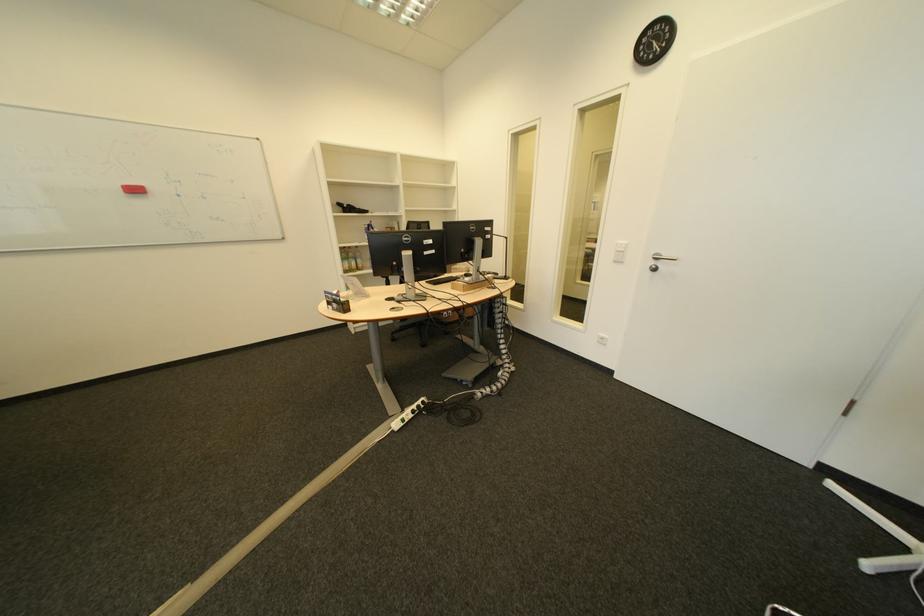
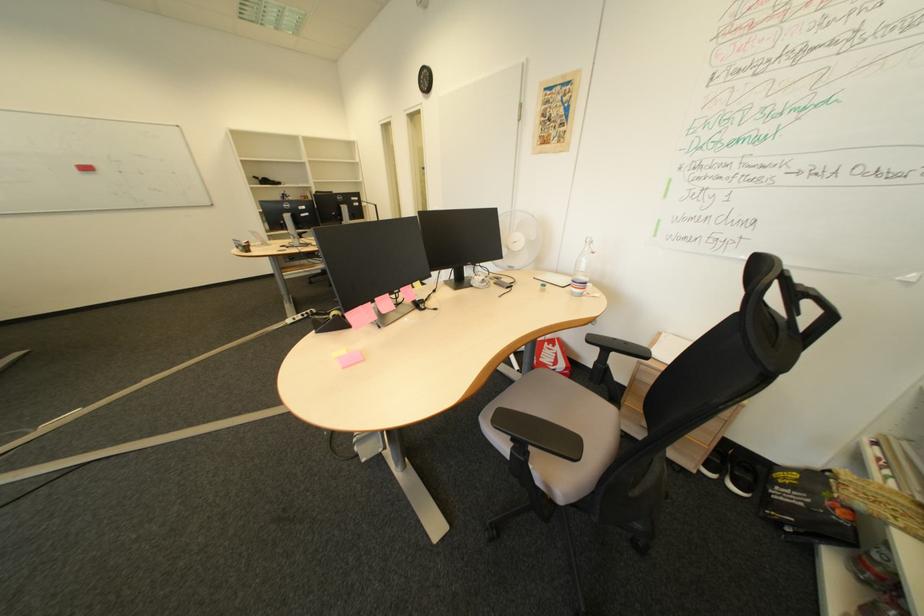
The point at (412,300) is marked in the first image. Where is the corresponding point in the second image?

(301, 246)